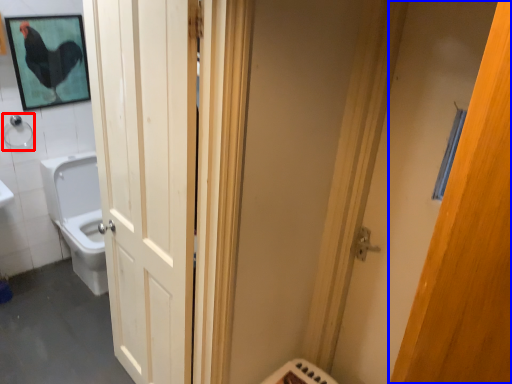
Question: Which object is further to the camera taking this photo, shower (highlighted by a red box) or door (highlighted by a blue box)?

Choices:
 (A) shower
 (B) door

Answer: (A)